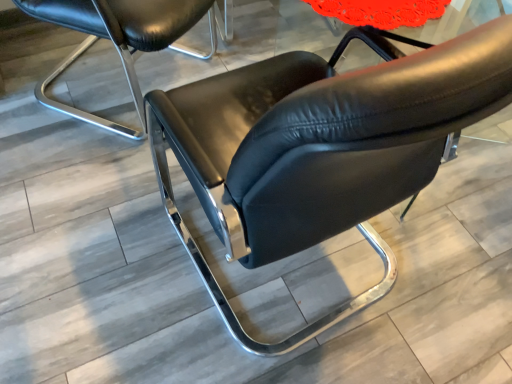
This screenshot has height=384, width=512. I want to click on free region under matte black chair at center, the 1th chair viewed from the left (from a real-world perspective), so click(x=121, y=81).